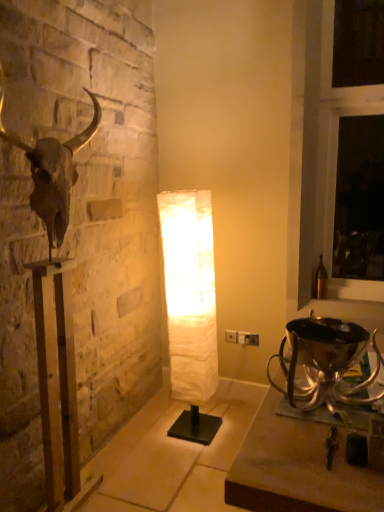
At what (x,y) coordinates should I click in order to perform the action: click on free space above white marble lamp at center (from a real-world perspective). Please return your answer as a coordinate pair (x, y). This screenshot has height=512, width=384. Looking at the image, I should click on (171, 452).